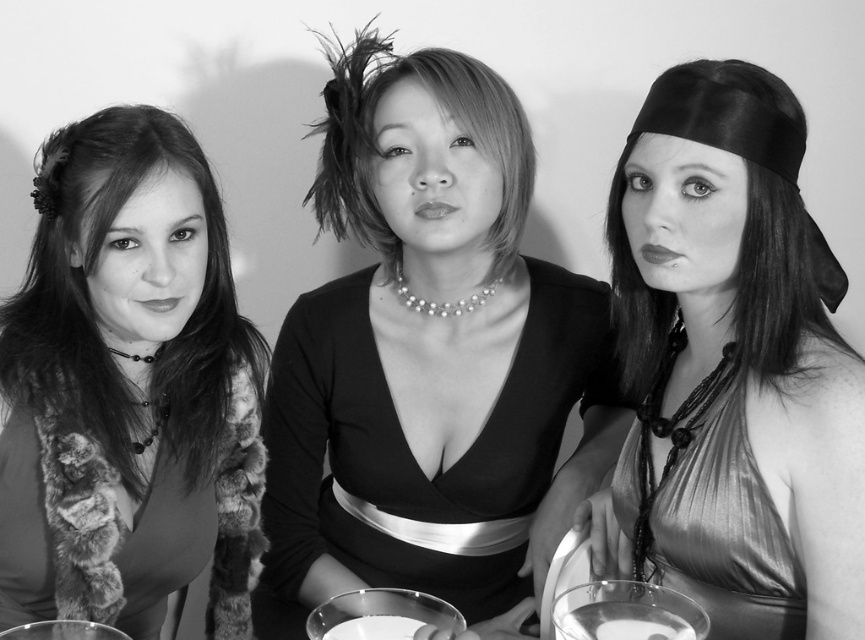
In the scene shown: Is smooth black dress at center below fur scarf at left?

No, smooth black dress at center is not below fur scarf at left.

Who is more distant from viewer, (430, 49) or (113, 172)?

The point (430, 49) is more distant.

The height and width of the screenshot is (640, 865). Describe the element at coordinates (430, 353) in the screenshot. I see `smooth black dress at center` at that location.

The width and height of the screenshot is (865, 640). In order to click on smooth black dress at center in this screenshot , I will do `click(430, 353)`.

Who is positioned more to the left, satin metallic dress at right or clear glass wine glass at lower center?

From the viewer's perspective, clear glass wine glass at lower center appears more on the left side.

This screenshot has width=865, height=640. What are the coordinates of `satin metallic dress at right` in the screenshot? It's located at (708, 509).

Who is more forward, (678, 484) or (699, 614)?

Point (699, 614) is in front.

Locate an element on the screen. This screenshot has width=865, height=640. satin metallic dress at right is located at coordinates (708, 509).

From the picture: Which of these two, smooth black dress at center or satin metallic dress at right, stands shorter?

Standing shorter between the two is satin metallic dress at right.

Is point (421, 278) more distant than point (689, 444)?

Yes, point (421, 278) is behind point (689, 444).

Find the location of a particular element. The height and width of the screenshot is (640, 865). smooth black dress at center is located at coordinates (430, 353).